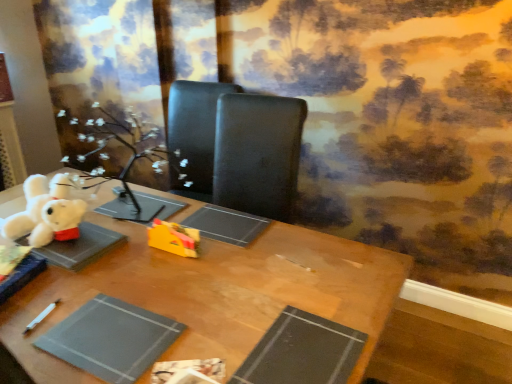
Identify the location of free location above black matte paperback book at lower center, which is counted as the 1th paperback book, starting from the right (from a real-world perspective). The width and height of the screenshot is (512, 384). (296, 342).